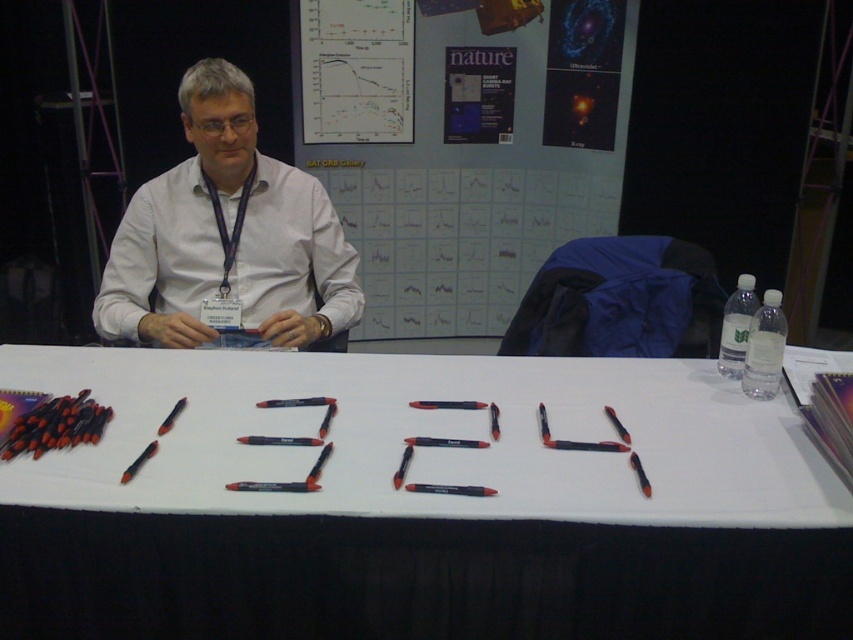
You are a guest at this event and want to read the content on the white paper at center and the matte paper poster at upper center. Which one is closer to you as you sit at the table?

The white paper at center is closer to you because it is in front of the matte paper poster at upper center.